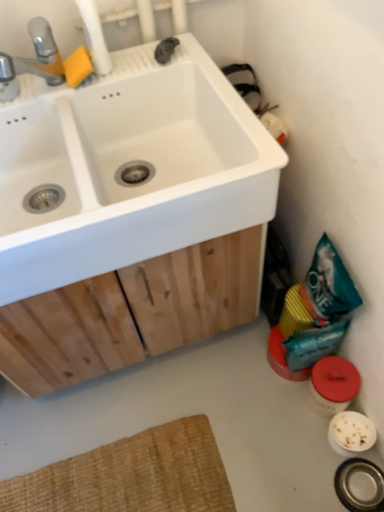
Question: From the image's perspective, is teal matte bag at lower right located beneath brushed metal faucet at upper left?

Choices:
 (A) no
 (B) yes

Answer: (B)

Question: Can you confirm if teal matte bag at lower right is wider than brushed metal faucet at upper left?

Choices:
 (A) no
 (B) yes

Answer: (A)

Question: Does teal matte bag at lower right turn towards brushed metal faucet at upper left?

Choices:
 (A) no
 (B) yes

Answer: (A)

Question: Can you confirm if teal matte bag at lower right is shorter than brushed metal faucet at upper left?

Choices:
 (A) yes
 (B) no

Answer: (B)

Question: Is teal matte bag at lower right far from brushed metal faucet at upper left?

Choices:
 (A) no
 (B) yes

Answer: (A)

Question: In the image, is brushed metal faucet at upper left positioned in front of or behind white matte sink at upper left?

Choices:
 (A) behind
 (B) front

Answer: (A)

Question: From a real-world perspective, is brushed metal faucet at upper left above or below white matte sink at upper left?

Choices:
 (A) below
 (B) above

Answer: (B)

Question: Considering the relative positions of brushed metal faucet at upper left and white matte sink at upper left in the image provided, is brushed metal faucet at upper left to the left or to the right of white matte sink at upper left?

Choices:
 (A) left
 (B) right

Answer: (A)

Question: Considering the positions of brushed metal faucet at upper left and white matte sink at upper left in the image, is brushed metal faucet at upper left taller or shorter than white matte sink at upper left?

Choices:
 (A) short
 (B) tall

Answer: (A)

Question: Is white matte sink at upper left inside or outside of teal matte bag at lower right?

Choices:
 (A) inside
 (B) outside

Answer: (B)

Question: In the image, is white matte sink at upper left on the left side or the right side of teal matte bag at lower right?

Choices:
 (A) left
 (B) right

Answer: (A)

Question: Relative to teal matte bag at lower right, is white matte sink at upper left in front or behind?

Choices:
 (A) front
 (B) behind

Answer: (A)

Question: Is white matte sink at upper left wider or thinner than teal matte bag at lower right?

Choices:
 (A) wide
 (B) thin

Answer: (A)

Question: Is brushed metal faucet at upper left bigger or smaller than teal matte bag at lower right?

Choices:
 (A) big
 (B) small

Answer: (B)

Question: Is brushed metal faucet at upper left to the left or to the right of teal matte bag at lower right in the image?

Choices:
 (A) left
 (B) right

Answer: (A)